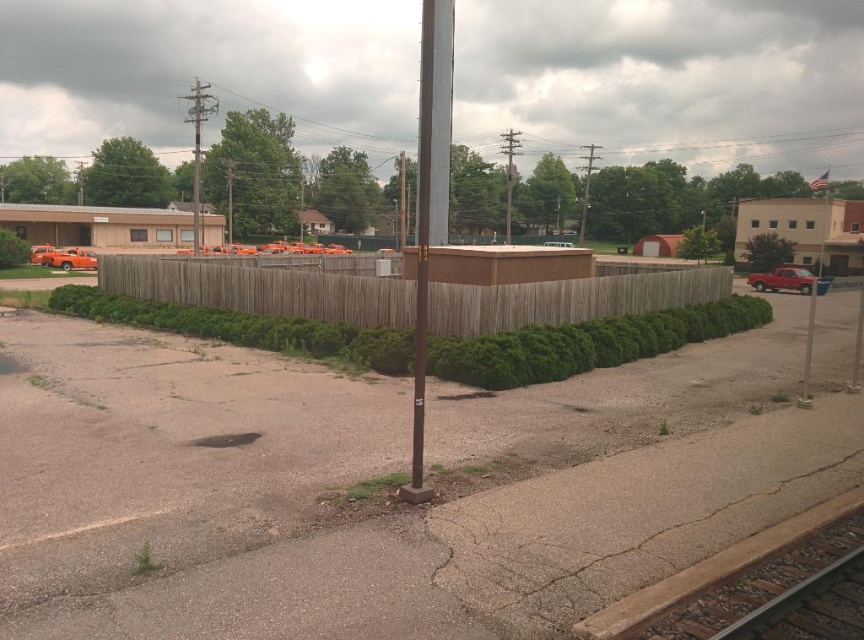
Who is more forward, (742, 298) or (449, 109)?

Point (742, 298) is in front.

I want to click on green wood fence at center, so click(x=586, y=342).

Is smooth metal train track at bottom right smaller than brown metallic pole at center?

Yes.

Does smooth metal train track at bottom right have a lesser height compared to brown metallic pole at center?

Correct, smooth metal train track at bottom right is not as tall as brown metallic pole at center.

Locate an element on the screen. This screenshot has width=864, height=640. smooth metal train track at bottom right is located at coordinates (757, 582).

Is brown wooden fence at center bigger than matte red truck at right?

No.

Consider the image. Who is more distant from viewer, (221, 300) or (793, 289)?

Positioned behind is point (793, 289).

Between point (264, 259) and point (826, 284), which one is positioned in front?

Point (826, 284)

At what (x,y) coordinates should I click in order to perform the action: click on brown wooden fence at center. Please return your answer as a coordinate pair (x, y). Looking at the image, I should click on (265, 285).